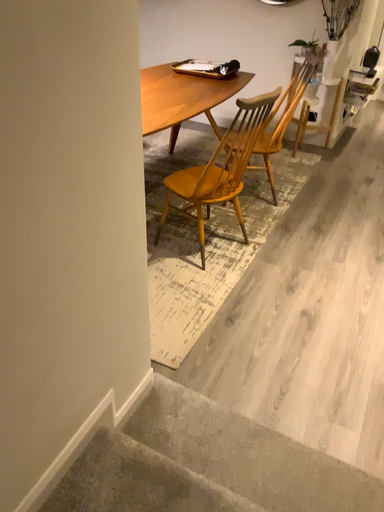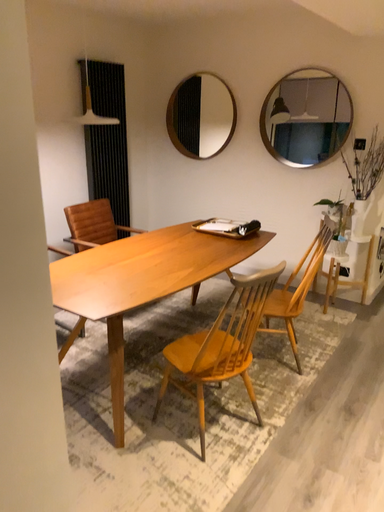
Question: Which way did the camera rotate in the video?

Choices:
 (A) rotated downward
 (B) rotated upward

Answer: (B)